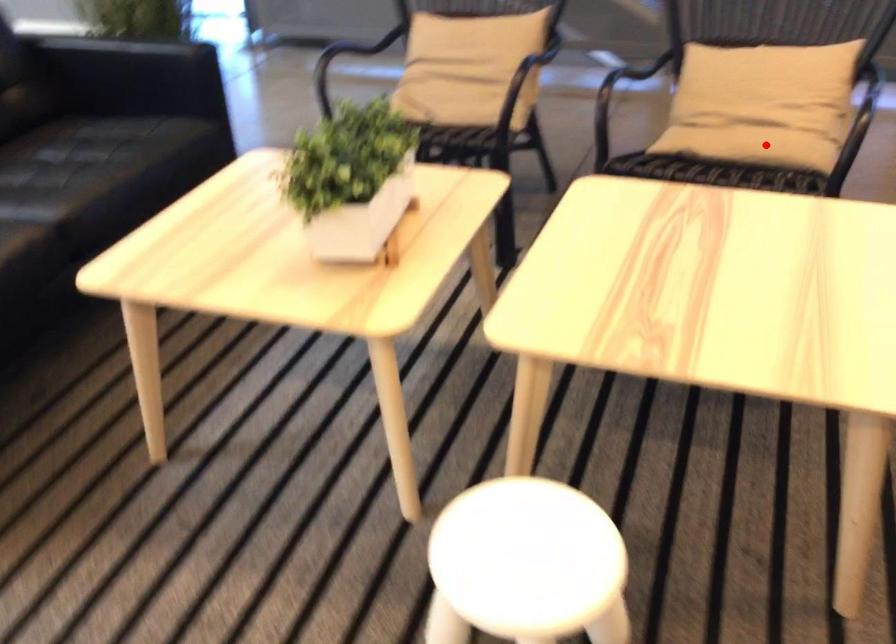
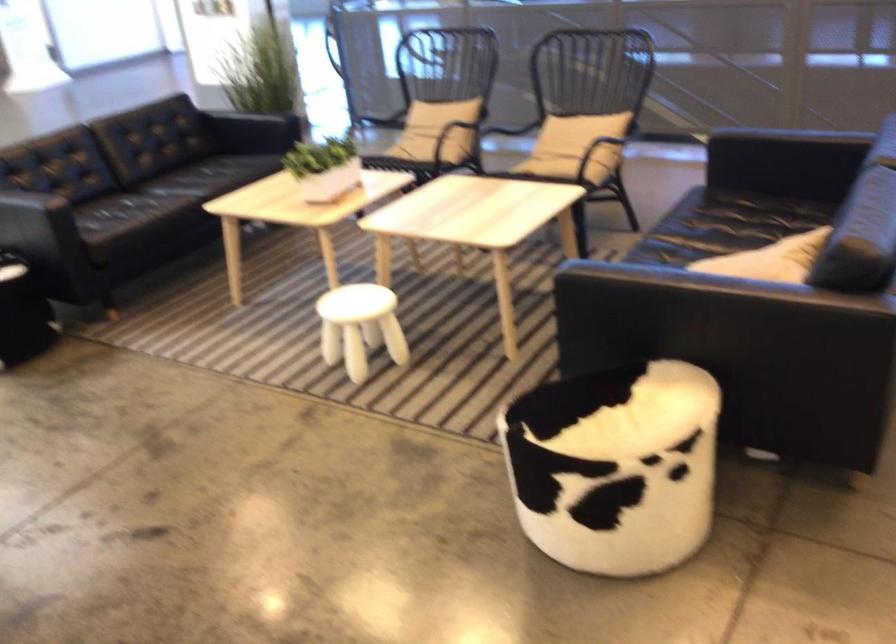
Question: I am providing you with two images of the same scene from different viewpoints. A red point is shown in image1. For the corresponding object point in image2, is it positioned nearer or farther from the camera?

Choices:
 (A) Nearer
 (B) Farther

Answer: (B)